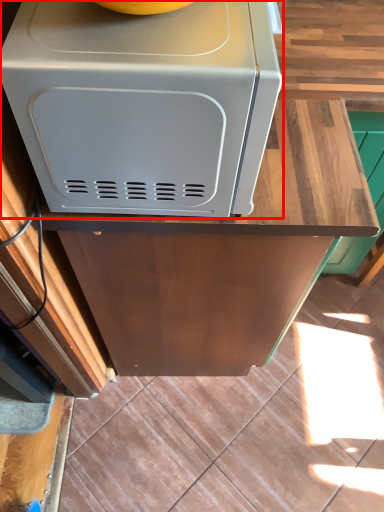
Question: In this image, where is home appliance (annotated by the red box) located relative to counter?

Choices:
 (A) left
 (B) right

Answer: (A)